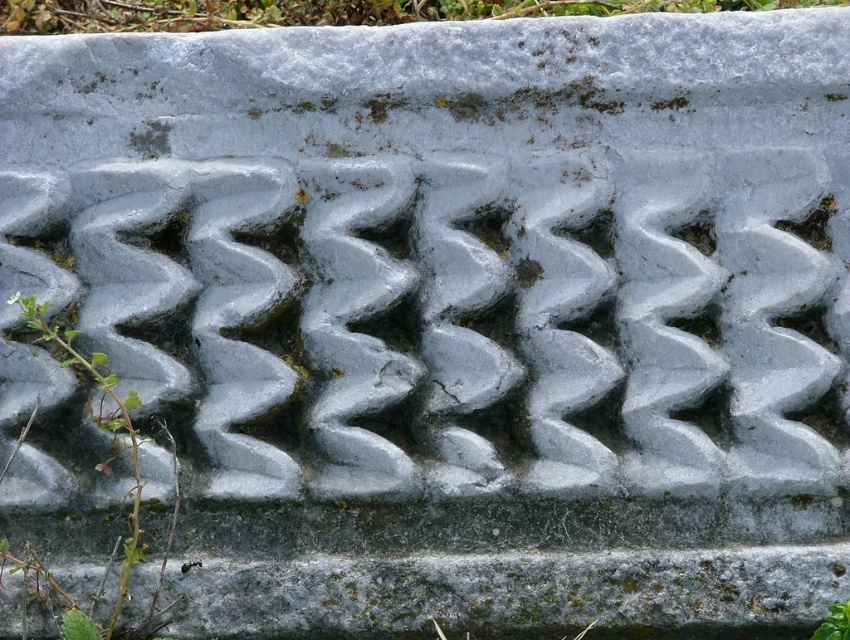
Who is higher up, green grass at upper center or green leafy weed at left?

green grass at upper center is higher up.

Which is below, green grass at upper center or green leafy weed at left?

Positioned lower is green leafy weed at left.

Locate an element on the screen. This screenshot has height=640, width=850. green grass at upper center is located at coordinates (326, 12).

The width and height of the screenshot is (850, 640). I want to click on green grass at upper center, so click(x=326, y=12).